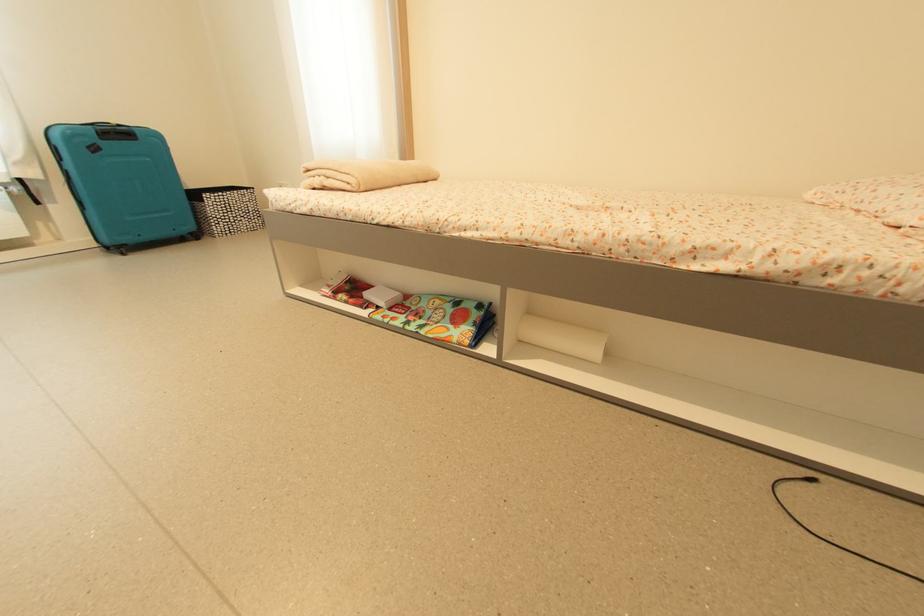
Find the location of a particular element. Image resolution: width=924 pixels, height=616 pixels. folded beige blanket is located at coordinates (363, 174).